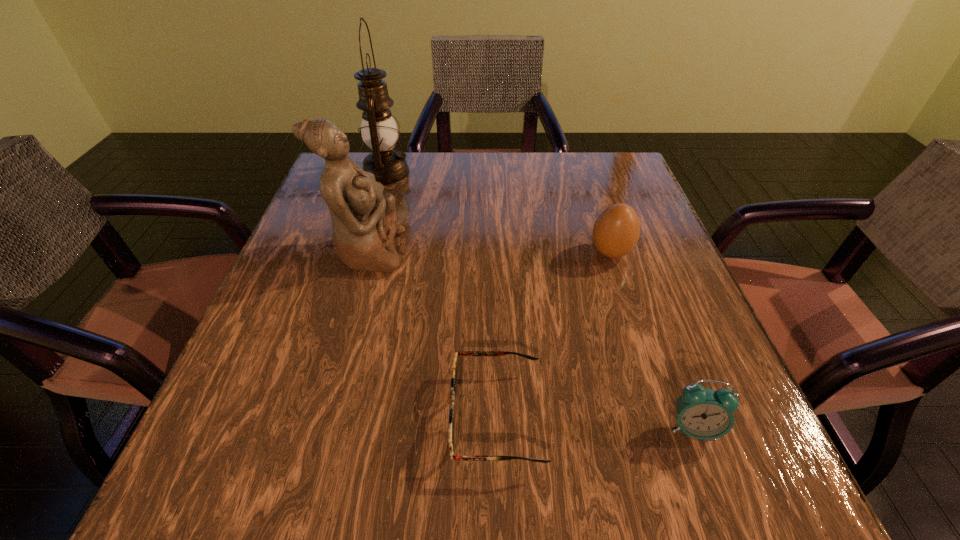
Find the location of `oil lamp`. oil lamp is located at coordinates (379, 131).

Find the location of a particular element. the tallest object is located at coordinates (379, 131).

The height and width of the screenshot is (540, 960). Identify the location of figurine. (364, 221).

This screenshot has width=960, height=540. What are the coordinates of `boiled egg` in the screenshot? It's located at (616, 231).

I want to click on the second shortest object, so click(701, 413).

Locate an element on the screen. This screenshot has height=540, width=960. the shortest object is located at coordinates (453, 381).

Locate an element on the screen. This screenshot has height=540, width=960. spectacles is located at coordinates (453, 381).

You are a GUI agent. You are given a task and a screenshot of the screen. Output one action in this format:
    pyautogui.click(x=<x>, y=<y>)
    Task: Click on the vacant region located on the front of the farthest object
    The height and width of the screenshot is (540, 960).
    Given the screenshot: What is the action you would take?
    pyautogui.click(x=361, y=261)

Identify the location of vacant space located on the front-facing side of the figurine. The height and width of the screenshot is (540, 960). (512, 252).

In order to click on vacant space located 0.080m on the right of the boiled egg in this screenshot , I will do `click(671, 253)`.